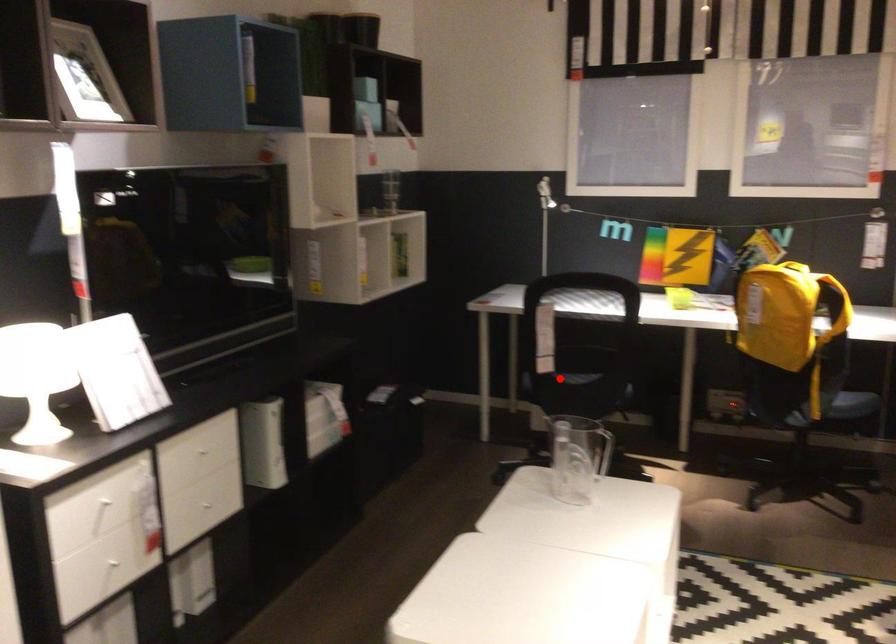
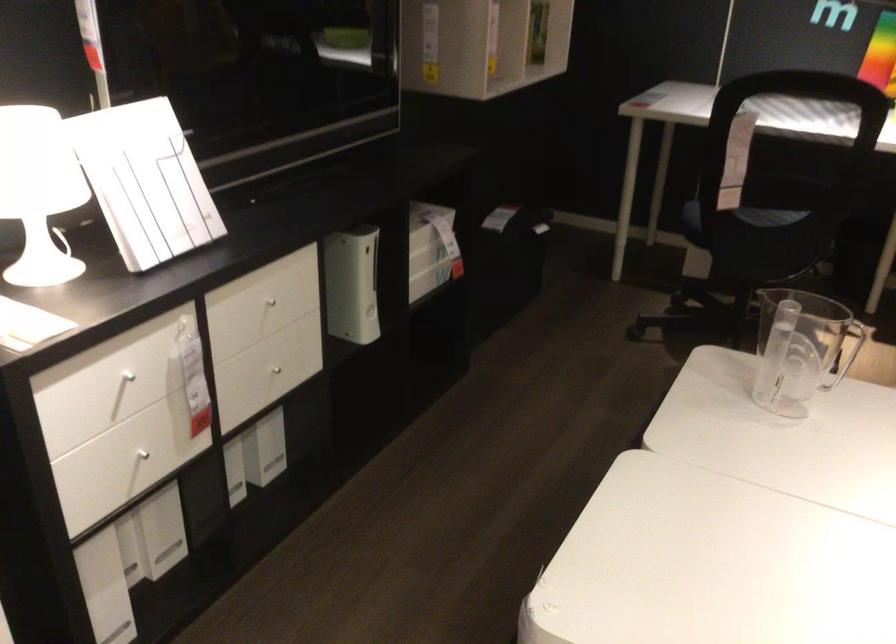
Question: I am providing you with two images of the same scene from different viewpoints. A red point is marked on the first image. Can you still see the location of the red point in image 2?

Choices:
 (A) Yes
 (B) No

Answer: (A)